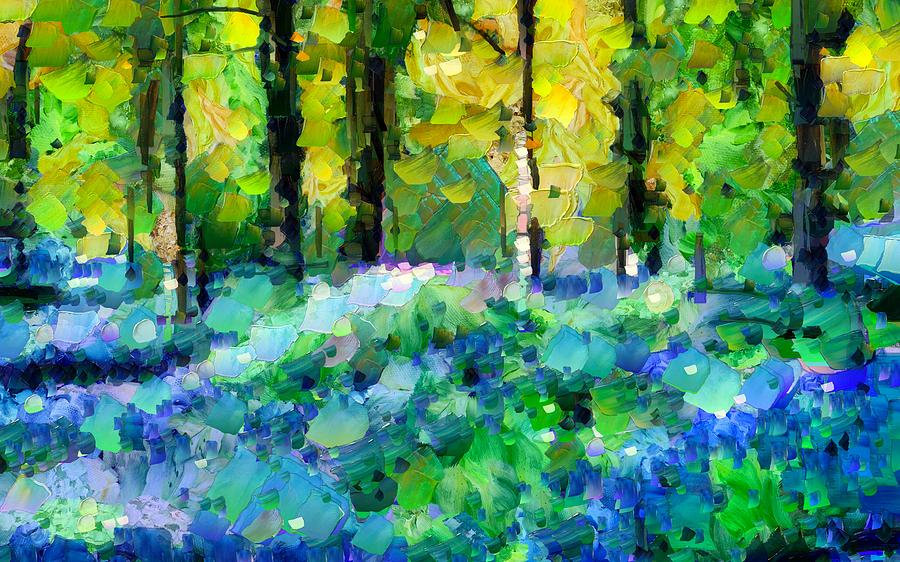
This screenshot has width=900, height=562. Find the location of `corners of painting`. corners of painting is located at coordinates (4, 7), (4, 552), (891, 556), (893, 8).